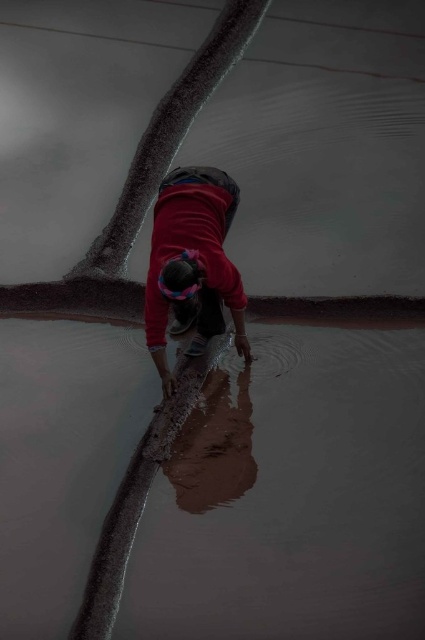
Does brown clay flood at lower center appear on the right side of red fabric person at center?

Correct, you'll find brown clay flood at lower center to the right of red fabric person at center.

Is brown clay flood at lower center above red fabric person at center?

Actually, brown clay flood at lower center is below red fabric person at center.

Where is `brown clay flood at lower center`? brown clay flood at lower center is located at coordinates (291, 497).